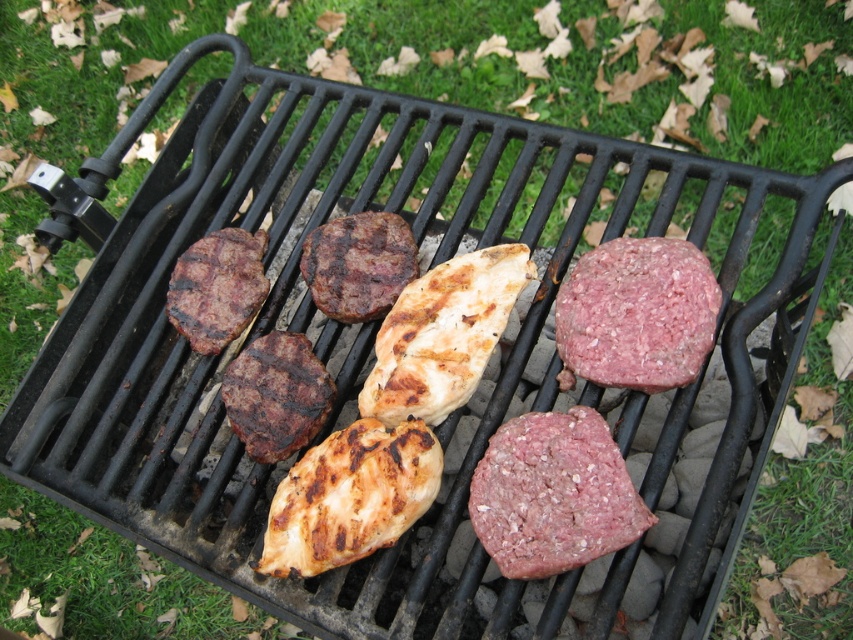
Looking at the grill, which piece of meat is positioned lower between the raw ground beef at bottom right and the brown charred beef at center?

The raw ground beef at bottom right is positioned lower than the brown charred beef at center.

You are a chef preparing to flip the meats on the grill. You have a spatula that is 5 inches long. Can you safely flip both the brown charred beef at center and the grilled brown steak at left without needing to move them closer together?

The distance between the brown charred beef at center and the grilled brown steak at left is 5.41 inches. Since the spatula is 5 inches long, it is slightly shorter than the space between them. Therefore, you may need to adjust their positions or use a longer tool to ensure safe flipping without overcrowding.

You are a food safety inspector checking the grill. You see the raw ground beef at bottom right and the brown charred beef at center. Which piece of meat is more likely to be undercooked?

The raw ground beef at bottom right is closer to the viewer than the brown charred beef at center, so it is more likely to be undercooked.